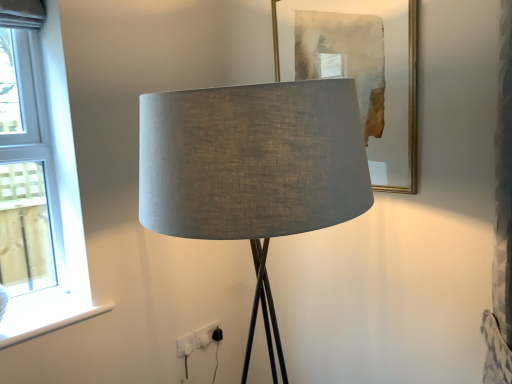
Question: Does point (72, 319) appear closer or farther from the camera than point (201, 344)?

Choices:
 (A) closer
 (B) farther

Answer: (A)

Question: In terms of width, does white smooth window sill at lower left look wider or thinner when compared to white plastic electric outlet at lower center, acting as the 2th electric outlet starting from the front?

Choices:
 (A) wide
 (B) thin

Answer: (A)

Question: Based on their relative distances, which object is nearer to the gold-framed mirror at upper center?

Choices:
 (A) matte gray fabric lamp at center
 (B) white plastic electric outlet at lower center, the 1th electric outlet in the back-to-front sequence
 (C) clear glass window at left
 (D) white plastic electric outlet at lower center, acting as the 1th electric outlet starting from the front
 (E) white smooth window sill at lower left

Answer: (A)

Question: Which is farther from the clear glass window at left?

Choices:
 (A) gold-framed mirror at upper center
 (B) matte gray fabric lamp at center
 (C) white plastic electric outlet at lower center, which ranks as the 2th electric outlet in right-to-left order
 (D) white smooth window sill at lower left
 (E) white plastic electric outlet at lower center, the 2th electric outlet positioned from the left

Answer: (A)